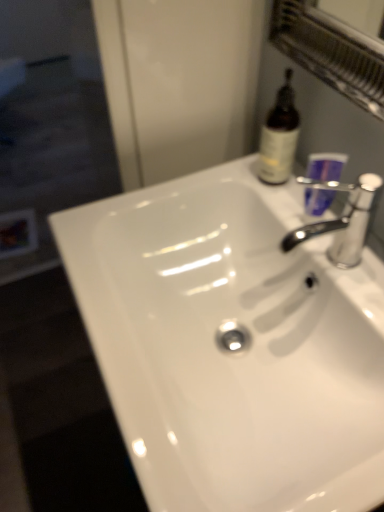
I want to click on empty space that is ontop of transparent glass screen door at left (from a real-world perspective), so click(x=41, y=142).